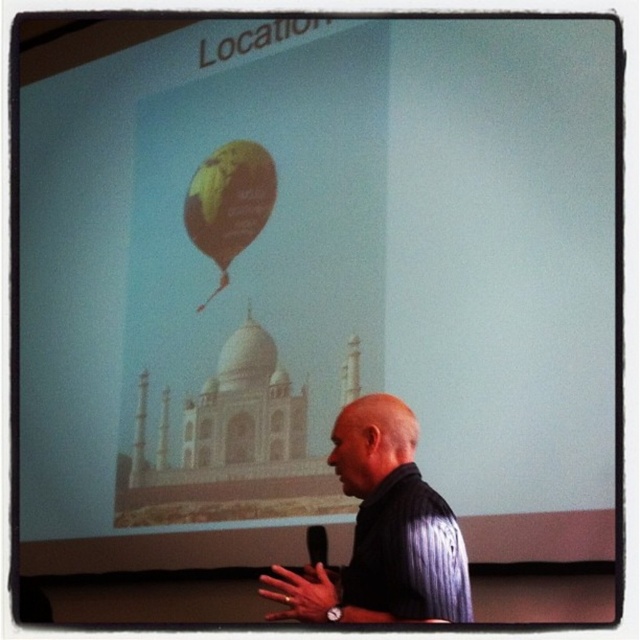
Question: Is black striped shirt at lower right thinner than yellow fabric balloon at upper center?

Choices:
 (A) no
 (B) yes

Answer: (A)

Question: Is black striped shirt at lower right smaller than yellow fabric balloon at upper center?

Choices:
 (A) yes
 (B) no

Answer: (B)

Question: Which object is farther from the camera taking this photo?

Choices:
 (A) black striped shirt at lower right
 (B) yellow fabric balloon at upper center

Answer: (B)

Question: Is black striped shirt at lower right closer to the viewer compared to yellow fabric balloon at upper center?

Choices:
 (A) no
 (B) yes

Answer: (B)

Question: Which point appears closest to the camera in this image?

Choices:
 (A) (324, 593)
 (B) (232, 232)

Answer: (A)